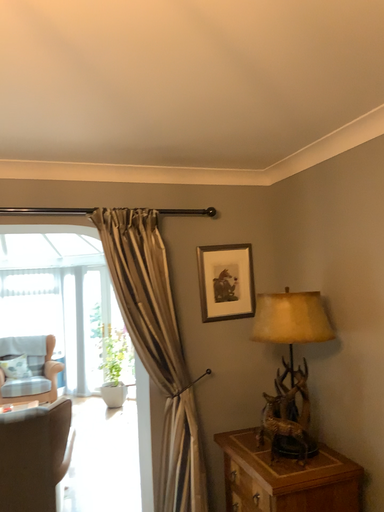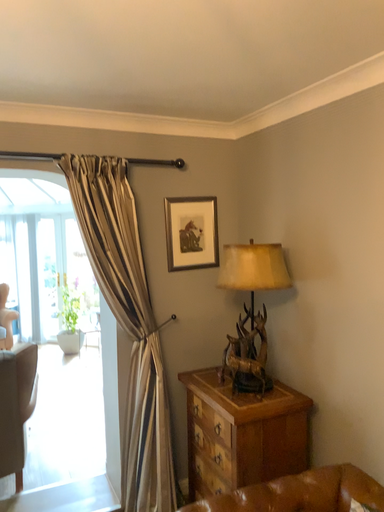
Question: How did the camera likely rotate when shooting the video?

Choices:
 (A) rotated upward
 (B) rotated downward

Answer: (B)